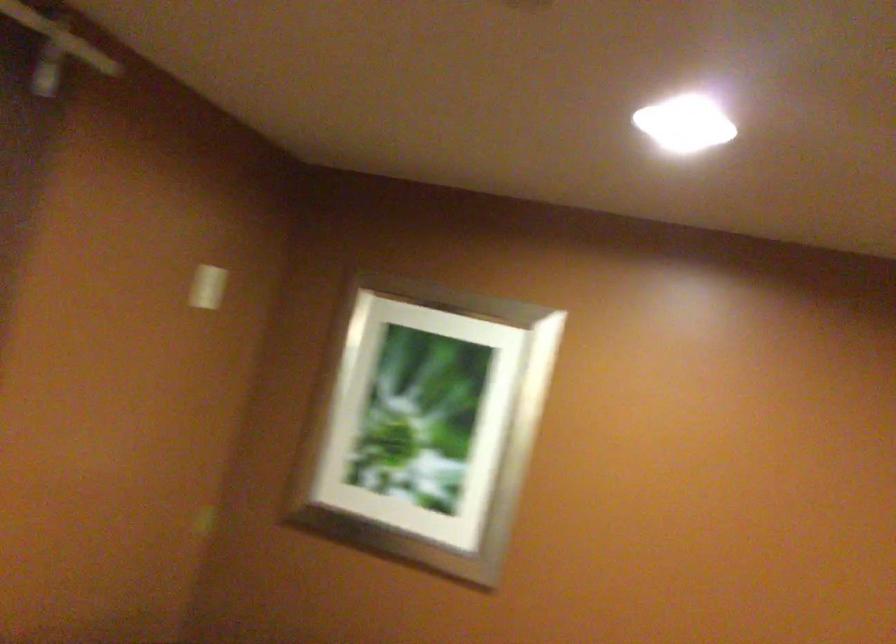
Question: The camera is either moving clockwise (left) or counter-clockwise (right) around the object. The first image is from the beginning of the video and the second image is from the end. Is the camera moving left or right when shooting the video?

Choices:
 (A) Left
 (B) Right

Answer: (B)